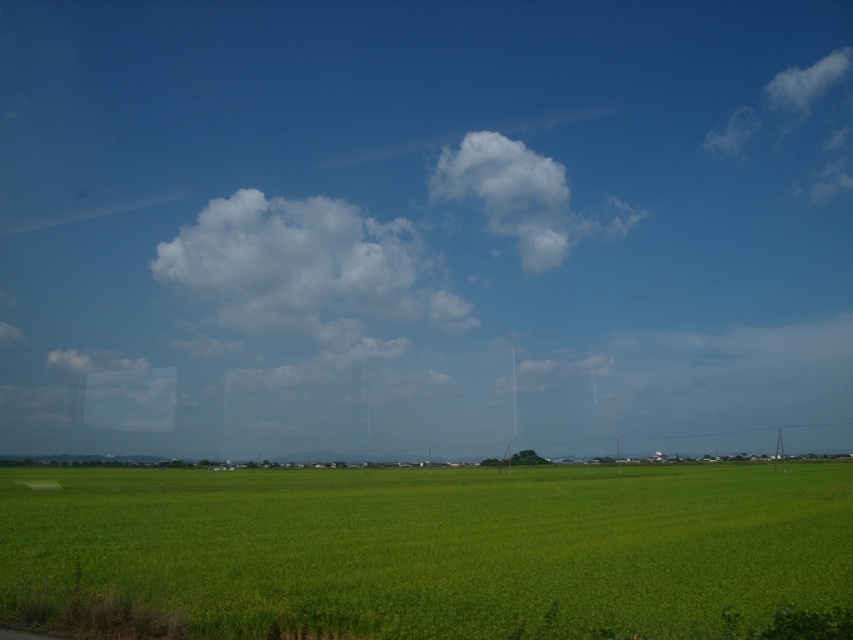
Question: Which object appears closest to the camera in this image?

Choices:
 (A) white fluffy cloud at upper center
 (B) green grass at lower center

Answer: (B)

Question: Observing the image, what is the correct spatial positioning of green grass at lower center in reference to white fluffy cloud at upper center?

Choices:
 (A) right
 (B) left

Answer: (B)

Question: Observing the image, what is the correct spatial positioning of green grass at lower center in reference to white fluffy cloud at upper center?

Choices:
 (A) left
 (B) right

Answer: (A)

Question: Is green grass at lower center to the left of white fluffy cloud at upper center from the viewer's perspective?

Choices:
 (A) no
 (B) yes

Answer: (B)

Question: Which point is farther to the camera?

Choices:
 (A) (370, 500)
 (B) (616, 205)

Answer: (B)